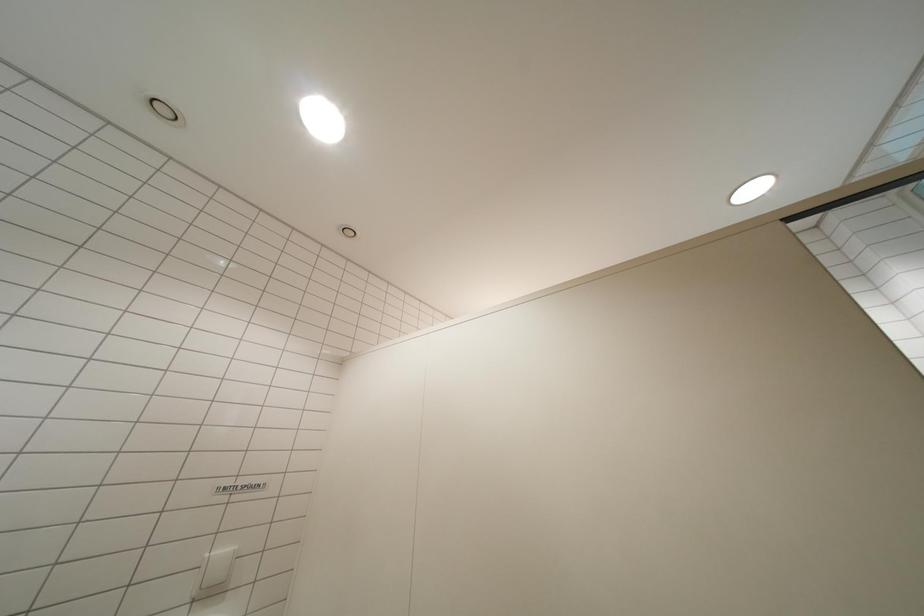
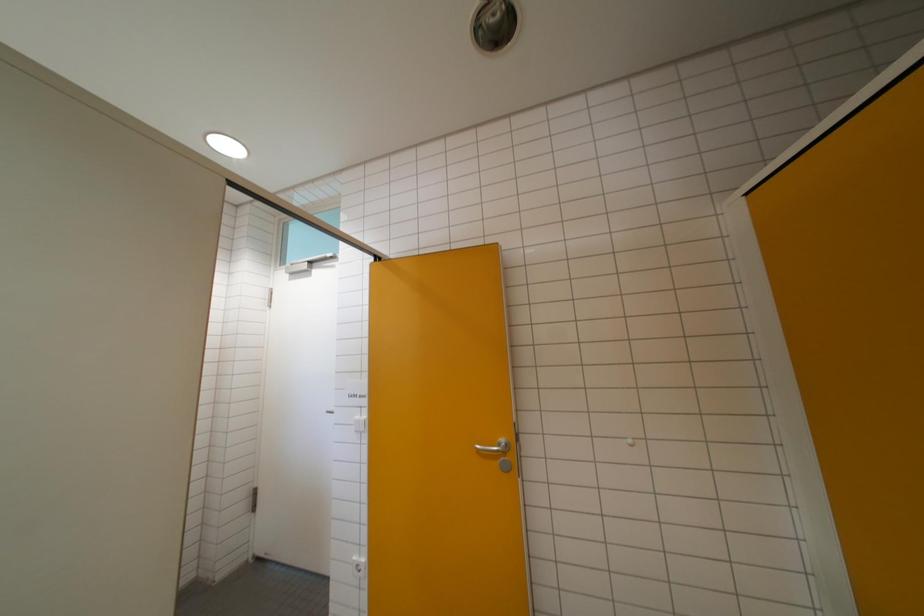
First-person continuous shooting, in which direction is the camera rotating?

The camera's rotation is toward right-up.